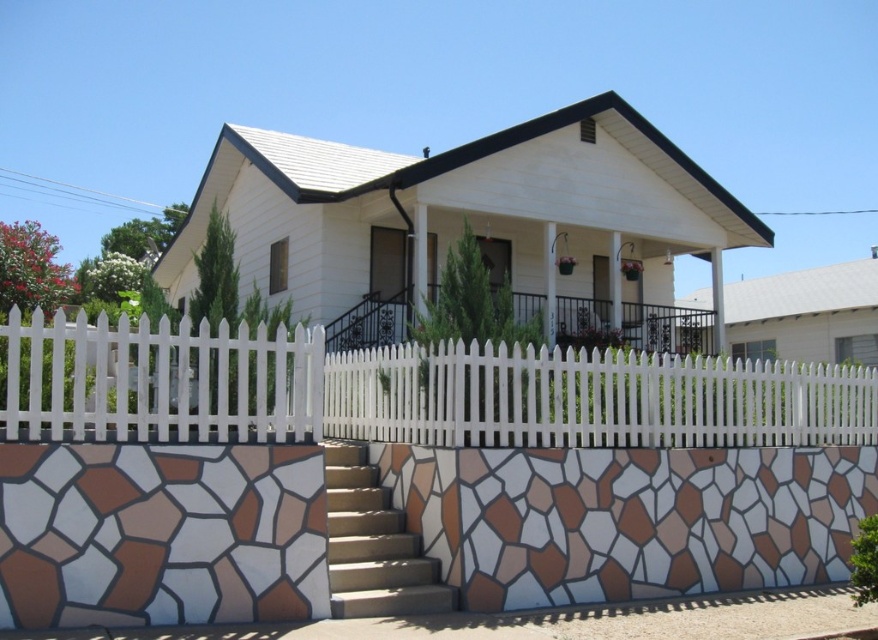
Locate an element on the screen. The image size is (878, 640). white picket fence at left is located at coordinates (157, 380).

Measure the distance between white picket fence at left and brown stone stairs at lower left.

They are 1.82 meters apart.

The width and height of the screenshot is (878, 640). I want to click on white picket fence at left, so click(x=157, y=380).

Between white picket fence at center and brown stone stairs at lower left, which one is positioned higher?

Positioned higher is white picket fence at center.

Does point (623, 410) come closer to viewer compared to point (427, 602)?

No, (623, 410) is further to viewer.

What do you see at coordinates (589, 397) in the screenshot? This screenshot has width=878, height=640. I see `white picket fence at center` at bounding box center [589, 397].

At what (x,y) coordinates should I click in order to perform the action: click on white picket fence at center. Please return your answer as a coordinate pair (x, y). This screenshot has width=878, height=640. Looking at the image, I should click on (589, 397).

Consider the image. Between white picket fence at lower center and brown stone stairs at lower left, which one has more height?

Standing taller between the two is white picket fence at lower center.

Looking at this image, is white picket fence at lower center positioned in front of brown stone stairs at lower left?

Yes, it is.

Does point (212, 392) lie in front of point (335, 474)?

Yes.

Where is `white picket fence at lower center`? This screenshot has width=878, height=640. white picket fence at lower center is located at coordinates (404, 390).